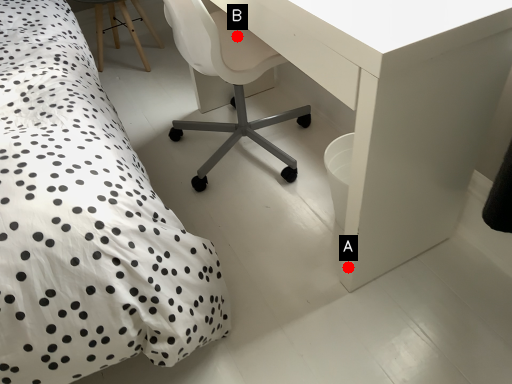
Question: Two points are circled on the image, labeled by A and B beside each circle. Which point is closer to the camera?

Choices:
 (A) A is closer
 (B) B is closer

Answer: (A)